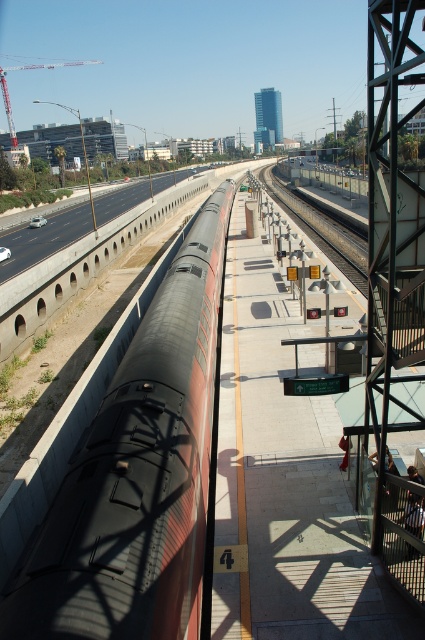
Is matte black train at center positioned behind black asphalt highway at left?

That is False.

Who is more forward, (136, 394) or (37, 248)?

Point (136, 394) is in front.

Locate an element on the screen. matte black train at center is located at coordinates (138, 474).

Is black asphalt highway at left to the right of black metal train track at center from the viewer's perspective?

No, black asphalt highway at left is not to the right of black metal train track at center.

Is black asphalt highway at left wider than black metal train track at center?

Yes.

Between point (161, 177) and point (291, 193), which one is positioned in front?

Point (291, 193) is more forward.

Identify the location of black asphalt highway at left. (44, 237).

Which is behind, point (186, 269) or point (320, 234)?

Point (320, 234)

I want to click on matte black train at center, so click(x=138, y=474).

Does point (116, 588) come in front of point (268, 188)?

Yes, it is in front of point (268, 188).

You are a GUI agent. You are given a task and a screenshot of the screen. Output one action in this format:
    pyautogui.click(x=<x>, y=<y>)
    Task: Click on the matte black train at center
    Image resolution: width=425 pixels, height=640 pixels.
    Given the screenshot: What is the action you would take?
    pos(138,474)